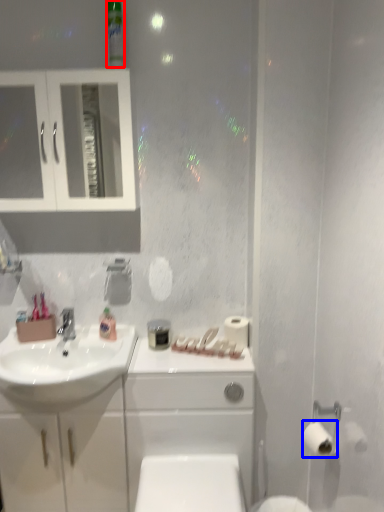
Question: Which object is further to the camera taking this photo, mouthwash (highlighted by a red box) or toilet paper (highlighted by a blue box)?

Choices:
 (A) mouthwash
 (B) toilet paper

Answer: (A)